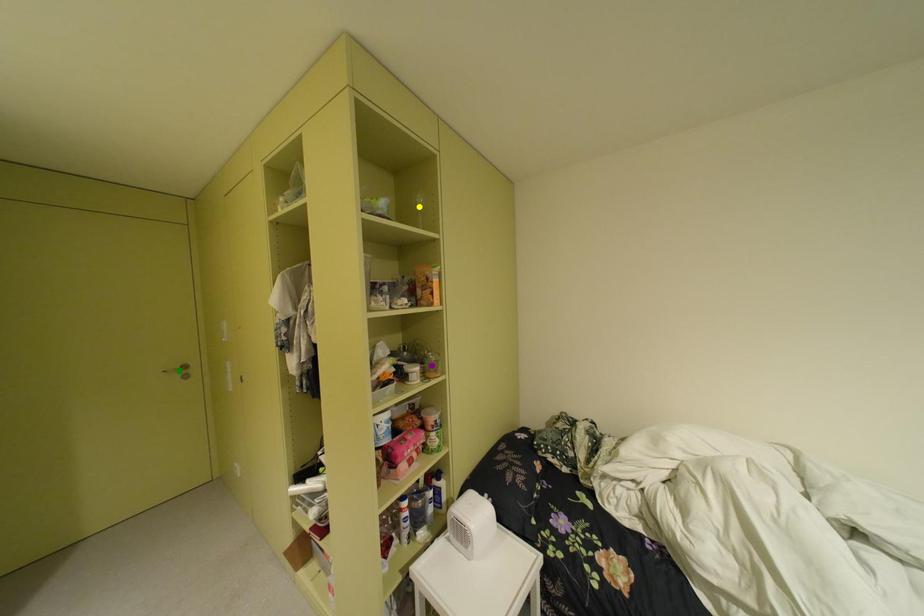
Order these from nearest to farthest:
purple point | yellow point | green point

yellow point
purple point
green point